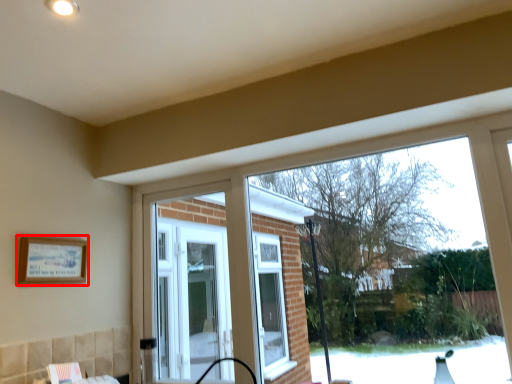
Question: From the image's perspective, where is picture frame (annotated by the red box) located relative to window?

Choices:
 (A) above
 (B) below

Answer: (A)